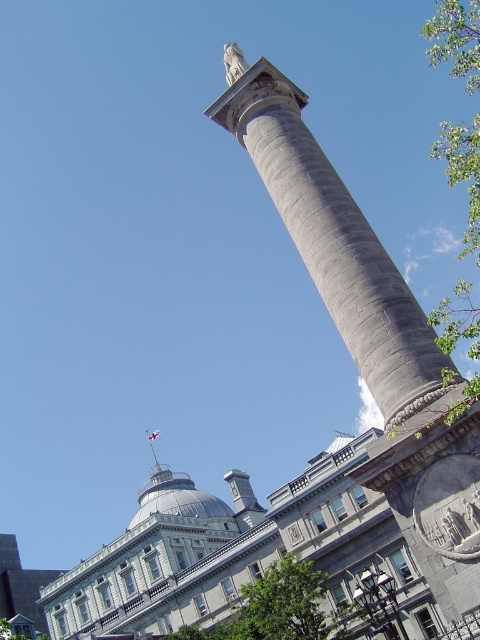
You are standing in front of the gray stone column at center and the green leafy tree at lower center. Which object is positioned higher in the image?

The gray stone column at center is positioned higher than the green leafy tree at lower center according to the description.

You are standing in front of the gray stone column at center and the green leafy tree at lower center. Which object is taller?

The gray stone column at center is taller than the green leafy tree at lower center.

You are standing in front of the gray stone column at center and want to take a photo of the green leafy tree at right. Can you see the tree clearly without the column blocking it?

The green leafy tree at right is behind the gray stone column at center, so the column will block the view of the tree.